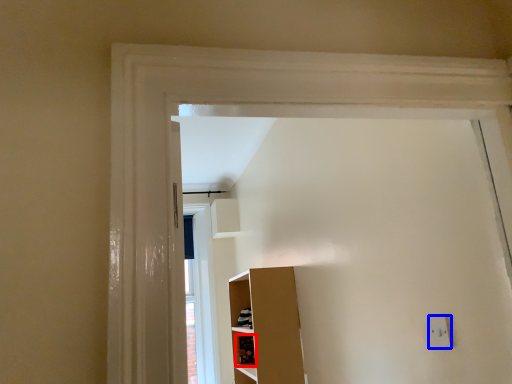
Question: Which of the following is the farthest to the observer, cabinet (highlighted by a red box) or electric outlet (highlighted by a blue box)?

Choices:
 (A) cabinet
 (B) electric outlet

Answer: (A)